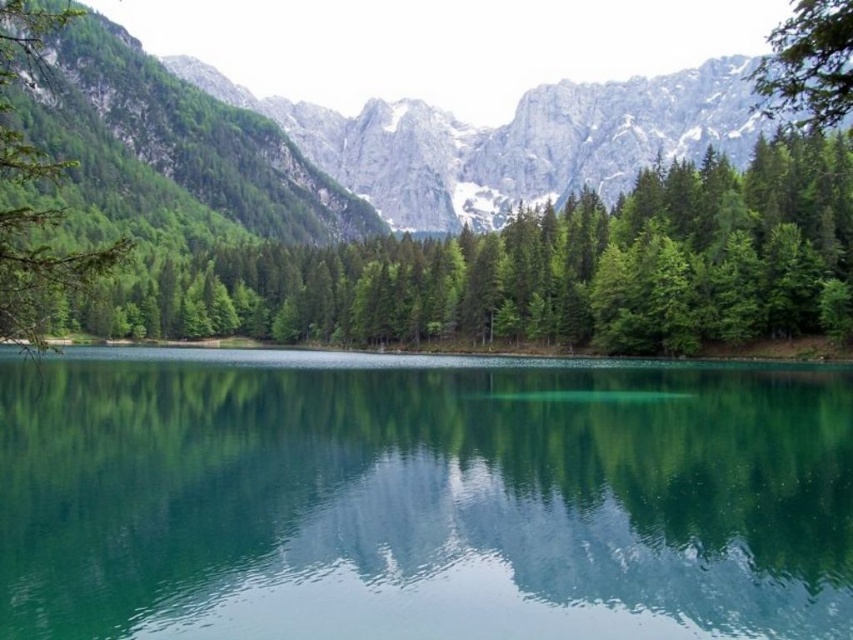
You are standing at the lakeside and want to take a photo of the green glassy water at center and the green matte tree at upper center. Which object is positioned higher in the image?

The green matte tree at upper center is positioned higher in the image than the green glassy water at center, which is located below it.

Consider the image. You are standing at the edge of the lake and want to locate the green glassy water at center. According to the coordinates provided, where exactly should you look?

The green glassy water at center is located at point (421, 497), so you should look towards that coordinate to find it.